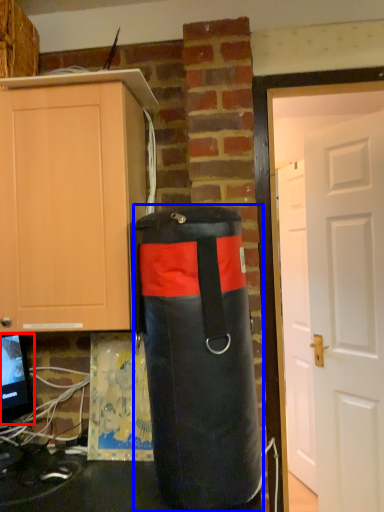
Question: Among these objects, which one is farthest to the camera, computer monitor (highlighted by a red box) or punching bag (highlighted by a blue box)?

Choices:
 (A) computer monitor
 (B) punching bag

Answer: (A)